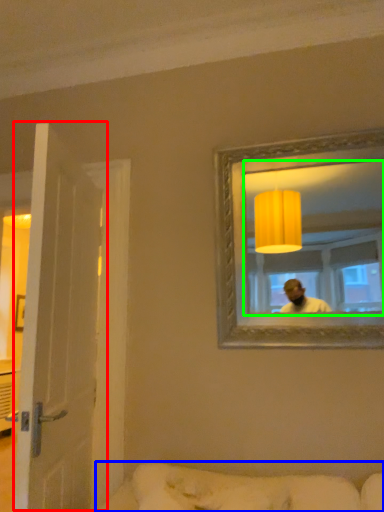
Question: Estimate the real-world distances between objects in this image. Which object is farther from door (highlighted by a red box), studio couch (highlighted by a blue box) or mirror (highlighted by a green box)?

Choices:
 (A) studio couch
 (B) mirror

Answer: (B)